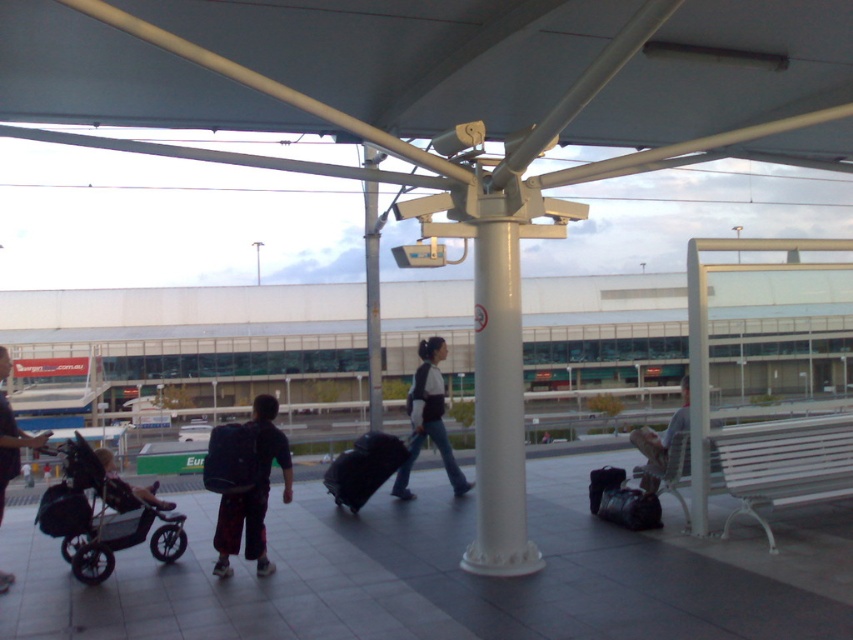
Does point (256, 444) come farther from viewer compared to point (363, 502)?

That is False.

Is dark blue backpack at center to the right of black fabric suitcase at center from the viewer's perspective?

No, dark blue backpack at center is not to the right of black fabric suitcase at center.

This screenshot has height=640, width=853. Find the location of `dark blue backpack at center`. dark blue backpack at center is located at coordinates pyautogui.click(x=245, y=483).

Looking at this image, measure the distance between point (80, 468) and camera.

Point (80, 468) and camera are 5.87 meters apart.

Does black rubber baby carriage at lower left have a lesser height compared to light brown fabric bag at center?

Yes.

This screenshot has width=853, height=640. What are the coordinates of `black rubber baby carriage at lower left` in the screenshot? It's located at [x=100, y=518].

Locate an element on the screen. The height and width of the screenshot is (640, 853). black rubber baby carriage at lower left is located at coordinates (100, 518).

Between matte black backpack at center and white glossy pole at center, which one has less height?

matte black backpack at center is shorter.

How much distance is there between matte black backpack at center and white glossy pole at center?

matte black backpack at center is 3.80 meters from white glossy pole at center.

At what (x,y) coordinates should I click in order to perform the action: click on matte black backpack at center. Please return your answer as a coordinate pair (x, y). The width and height of the screenshot is (853, 640). Looking at the image, I should click on (428, 419).